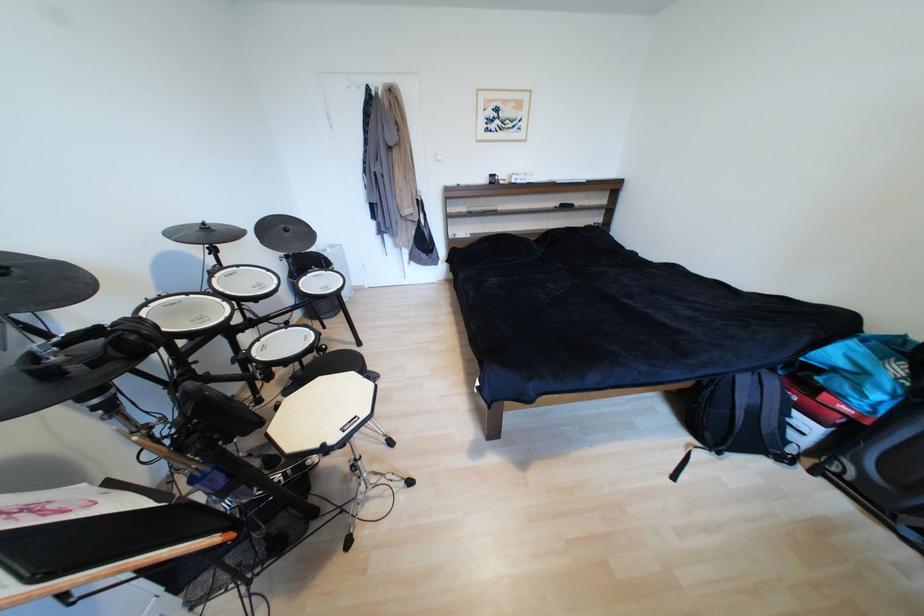
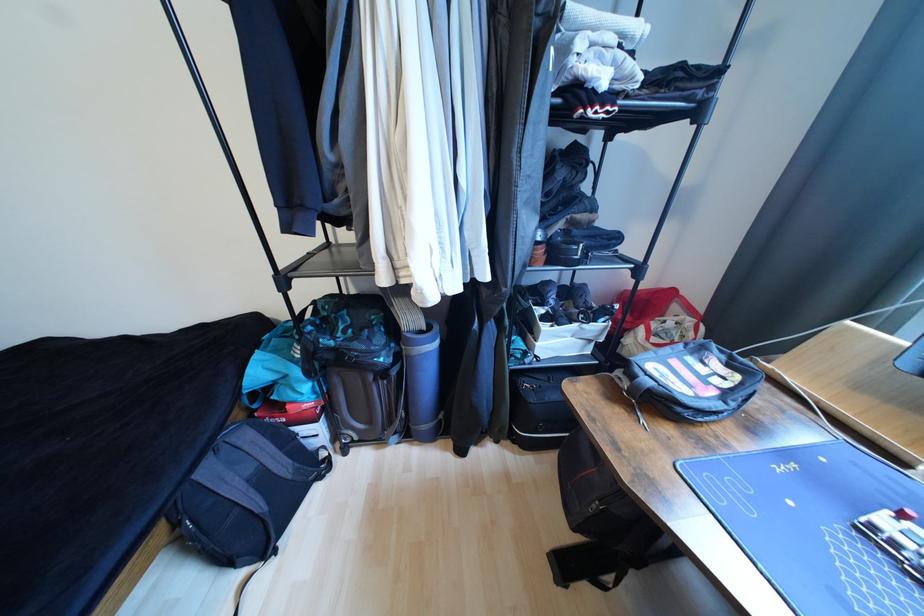
The images are taken continuously from a first-person perspective. In which direction is your viewpoint rotating?

The rotation direction of the camera is right-down.